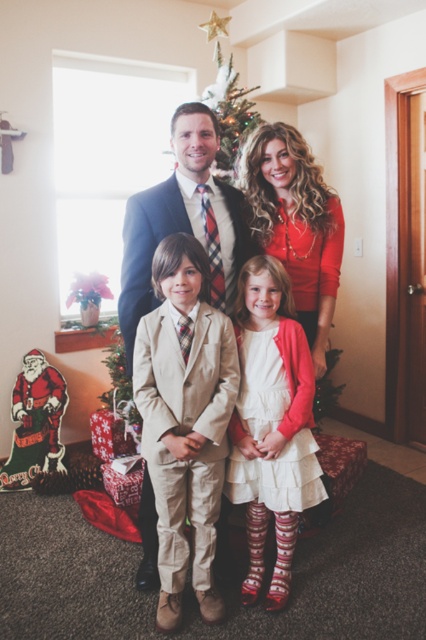
You are taking a photo of the family and notice two points in the image. The first point is at coordinate point (310, 371) and the second is at point (230, 76). Which point is closer to the camera?

Point (310, 371) is closer to the camera than point (230, 76).

In the festive family photo, there are two people wearing a white satin dress at center and a light brown suit at center. Which one is standing to the right of the other?

The white satin dress at center is positioned on the right side of the light brown suit at center.